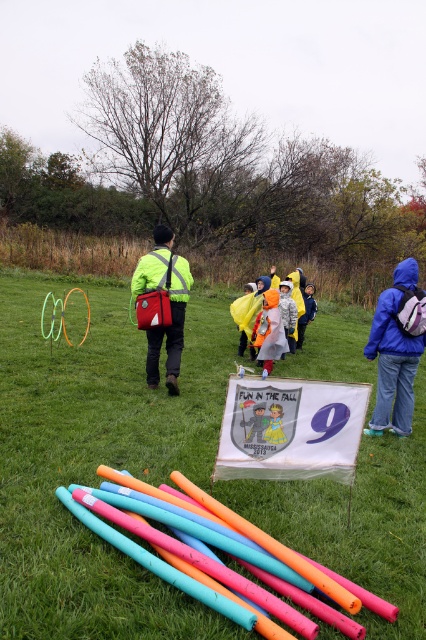
You are a gardener who wants to mow the green grass at center and fold the blue fleece jacket at right. Which task should you do first based on their heights?

The green grass at center has a lesser height compared to the blue fleece jacket at right, so you should mow the green grass at center first before folding the blue fleece jacket at right to avoid stepping on the jacket.

You are standing at the point marked by the coordinates (x=98, y=461) in the image. What do you see directly beneath your feet?

The point at (x=98, y=461) is covered in green grass at center.

You are planning to set up a picnic blanket in the park shown in the image. The picnic blanket requires a flat area of at least 1 meter by 1 meter. Considering the green grass at center, can you determine if there is enough space to place the blanket without overlapping any objects?

The green grass at center is located at point (98, 461), which suggests it is a central area. Since the grass is specified as the main ground cover and there are no other objects mentioned in the scene that would obstruct this area, there should be sufficient space to place the picnic blanket without overlapping any objects.